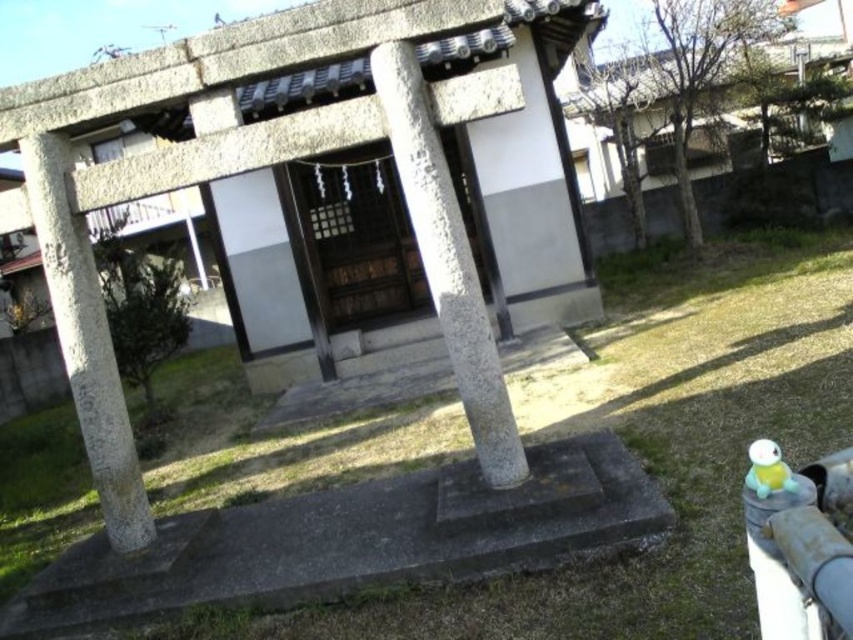
Question: Can you confirm if green grass at lower left is bigger than wooden door at center?

Choices:
 (A) no
 (B) yes

Answer: (B)

Question: Among these points, which one is nearest to the camera?

Choices:
 (A) (117, 477)
 (B) (303, 216)
 (C) (456, 236)
 (D) (512, 625)

Answer: (D)

Question: Which object is farther from the camera taking this photo?

Choices:
 (A) wooden door at center
 (B) gray stone pillar at center

Answer: (A)

Question: Is the position of wooden door at center less distant than that of gray concrete pillar at left?

Choices:
 (A) no
 (B) yes

Answer: (A)

Question: Among these points, which one is farthest from the camera?

Choices:
 (A) (115, 449)
 (B) (312, 198)

Answer: (B)

Question: Does gray stone pillar at center have a lesser width compared to gray concrete pillar at left?

Choices:
 (A) no
 (B) yes

Answer: (A)